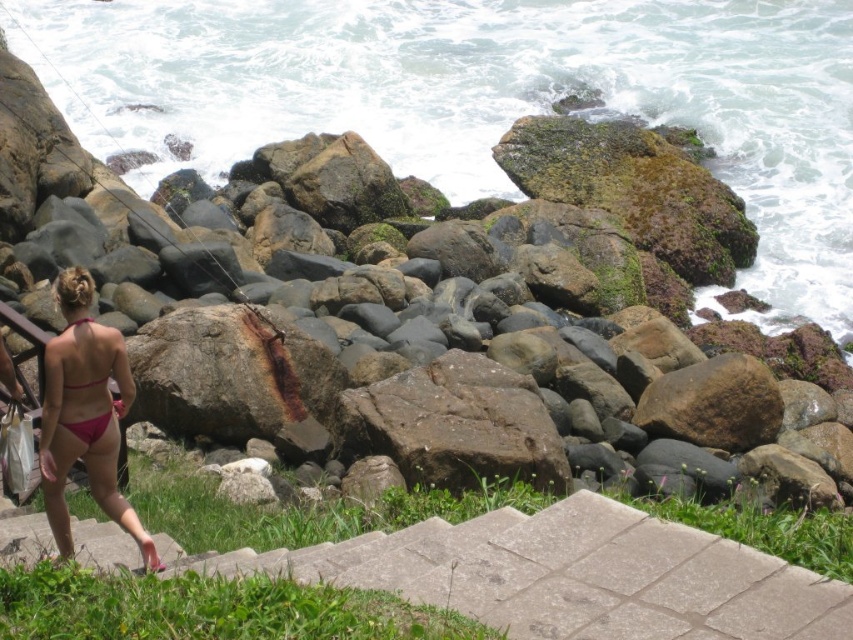
Can you confirm if concrete steps at lower center is taller than pink matte bikini at lower left?

Yes, concrete steps at lower center is taller than pink matte bikini at lower left.

Which is in front, point (592, 506) or point (74, 432)?

Point (592, 506) is in front.

Identify the location of concrete steps at lower center. (573, 576).

Can you confirm if rusty metal rock at center is positioned to the right of pink fabric bikini at lower left?

Correct, you'll find rusty metal rock at center to the right of pink fabric bikini at lower left.

Which is below, rusty metal rock at center or pink fabric bikini at lower left?

pink fabric bikini at lower left is below.

Between point (604, 288) and point (64, 477), which one is positioned behind?

The point (604, 288) is behind.

This screenshot has width=853, height=640. Find the location of `rusty metal rock at center`. rusty metal rock at center is located at coordinates (112, 216).

Can you confirm if pink fabric bikini at lower left is wider than pink matte bikini at lower left?

Yes.

Where is `pink fabric bikini at lower left`? This screenshot has width=853, height=640. pink fabric bikini at lower left is located at coordinates (85, 413).

You are a GUI agent. You are given a task and a screenshot of the screen. Output one action in this format:
    pyautogui.click(x=<x>, y=<y>)
    Task: Click on the pink fabric bikini at lower left
    
    Given the screenshot: What is the action you would take?
    pyautogui.click(x=85, y=413)